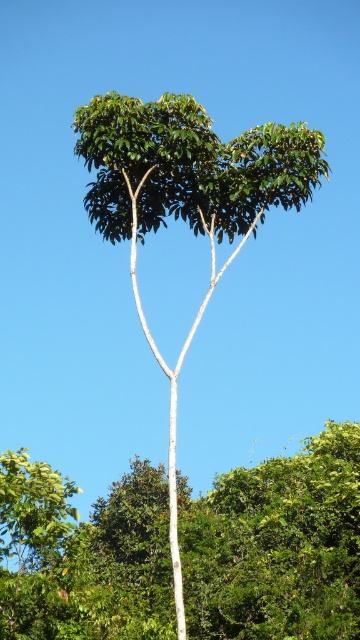
Question: Where is green leafy tree at center located in relation to green matte tree at center in the image?

Choices:
 (A) below
 (B) above

Answer: (A)

Question: Which of the following is the farthest from the observer?

Choices:
 (A) green leafy tree at center
 (B) green matte tree at center

Answer: (A)

Question: Which point is closer to the camera?

Choices:
 (A) (132, 273)
 (B) (273, 512)

Answer: (A)

Question: Does green leafy tree at center appear on the right side of green matte tree at center?

Choices:
 (A) no
 (B) yes

Answer: (B)

Question: Is green leafy tree at center closer to the viewer compared to green matte tree at center?

Choices:
 (A) no
 (B) yes

Answer: (A)